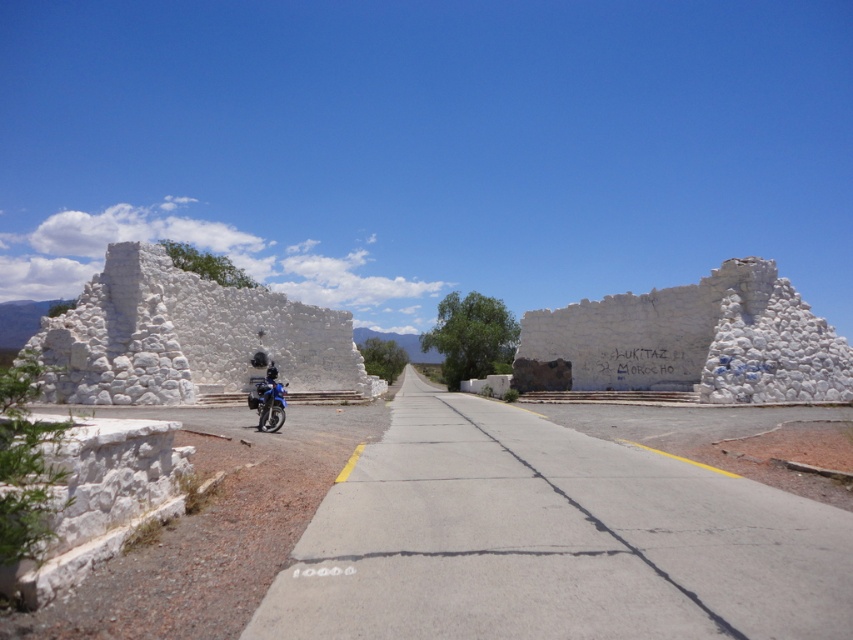
You are a photographer planning to take a picture of the white stone ruins at left and the white stone ruins at center from the road. Which ruins will appear taller in the photo?

The white stone ruins at left will appear taller in the photo because it is much taller than the white stone ruins at center.

You are a tourist standing at the edge of the road and want to take a photo of both the white stone ruins at center and the blue metallic motorcycle at center. Which object should you focus on first to ensure both are in the frame?

You should focus on the white stone ruins at center first because it is closer to you than the blue metallic motorcycle at center, so adjusting the camera to include it will also capture the motorcycle in the background.

You are a tourist standing at the center of the road. You want to take a photo of both the white stone ruins at center and the blue metallic motorcycle at center. Which object should you zoom in on first to ensure both fit in the frame?

You should zoom in on the blue metallic motorcycle at center first because it is shorter than the white stone ruins at center. By focusing on the motorcycle, you can adjust the zoom to include both objects in the frame since the ruins are taller and might require a wider angle.